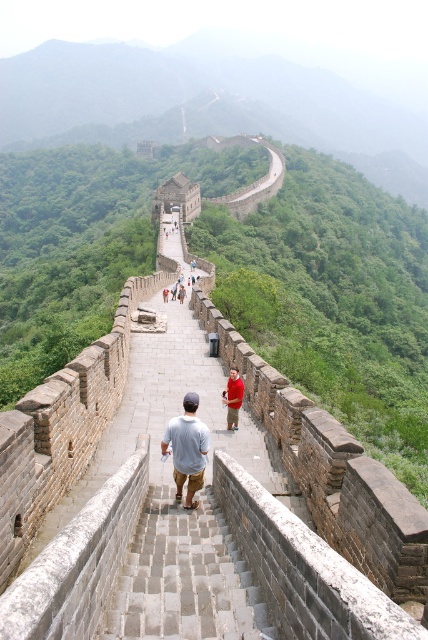
Can you confirm if light blue cotton shirt at center is wider than red cotton shirt at center?

In fact, light blue cotton shirt at center might be narrower than red cotton shirt at center.

Can you confirm if light blue cotton shirt at center is positioned above red cotton shirt at center?

Actually, light blue cotton shirt at center is below red cotton shirt at center.

Which is behind, point (174, 435) or point (235, 400)?

The point (235, 400) is behind.

You are a GUI agent. You are given a task and a screenshot of the screen. Output one action in this format:
    pyautogui.click(x=<x>, y=<y>)
    Task: Click on the light blue cotton shirt at center
    The width and height of the screenshot is (428, 640).
    Given the screenshot: What is the action you would take?
    (187, 449)